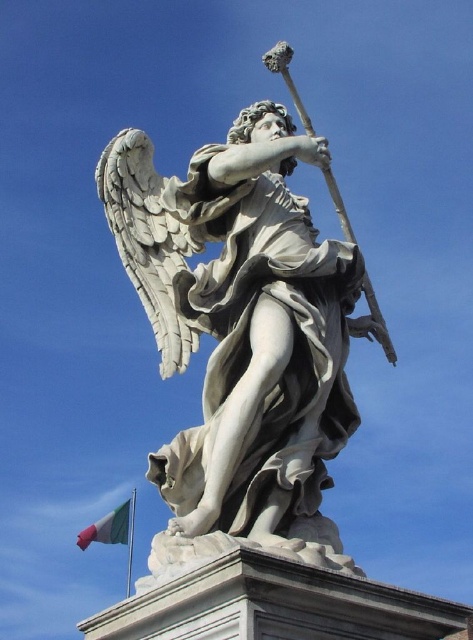
Question: Is white marble statue at center thinner than green fabric flag at lower left?

Choices:
 (A) no
 (B) yes

Answer: (A)

Question: Which of the following is the closest to the observer?

Choices:
 (A) white marble statue at center
 (B) green fabric flag at lower left

Answer: (A)

Question: Can you confirm if white marble statue at center is positioned below green fabric flag at lower left?

Choices:
 (A) no
 (B) yes

Answer: (A)

Question: Is white marble statue at center positioned behind green fabric flag at lower left?

Choices:
 (A) no
 (B) yes

Answer: (A)

Question: Which point appears closest to the camera in this image?

Choices:
 (A) (166, 464)
 (B) (134, 499)

Answer: (A)